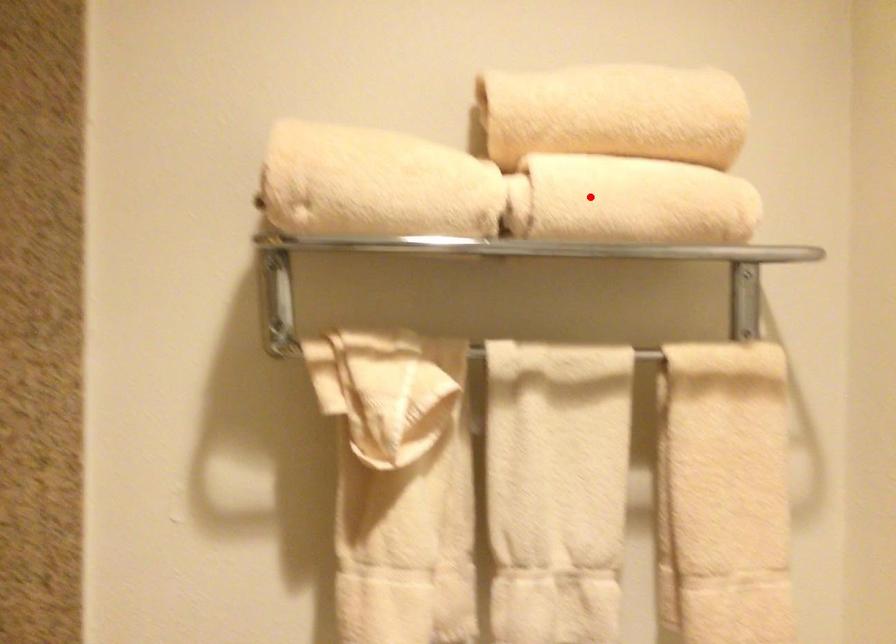
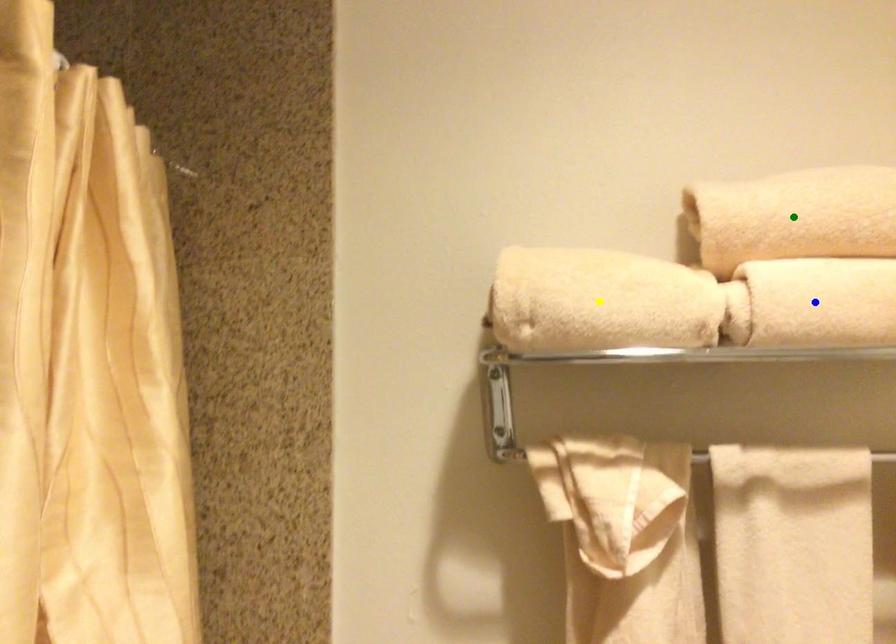
Question: I am providing you with two images of the same scene from different viewpoints. A red point is marked on the first image. You are given multiple points on the second image. Which point in image 2 is actually the same real-world point as the red point in image 1?

Choices:
 (A) green point
 (B) yellow point
 (C) blue point

Answer: (C)